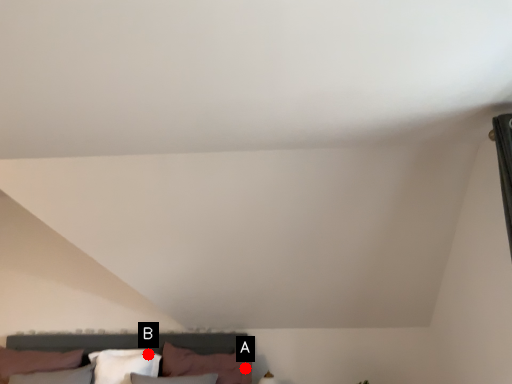
Question: Two points are circled on the image, labeled by A and B beside each circle. Which of the following is the closest to the observer?

Choices:
 (A) A is closer
 (B) B is closer

Answer: (A)